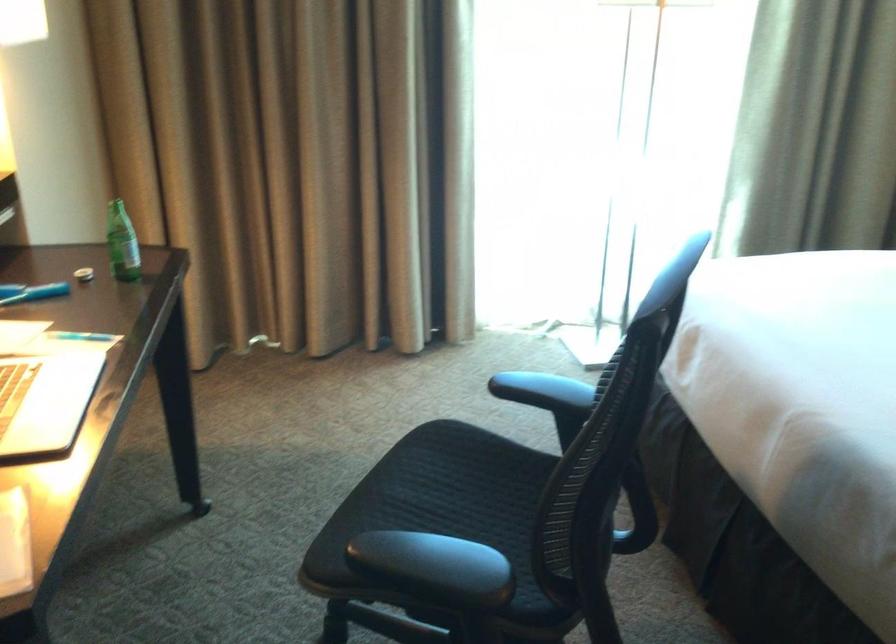
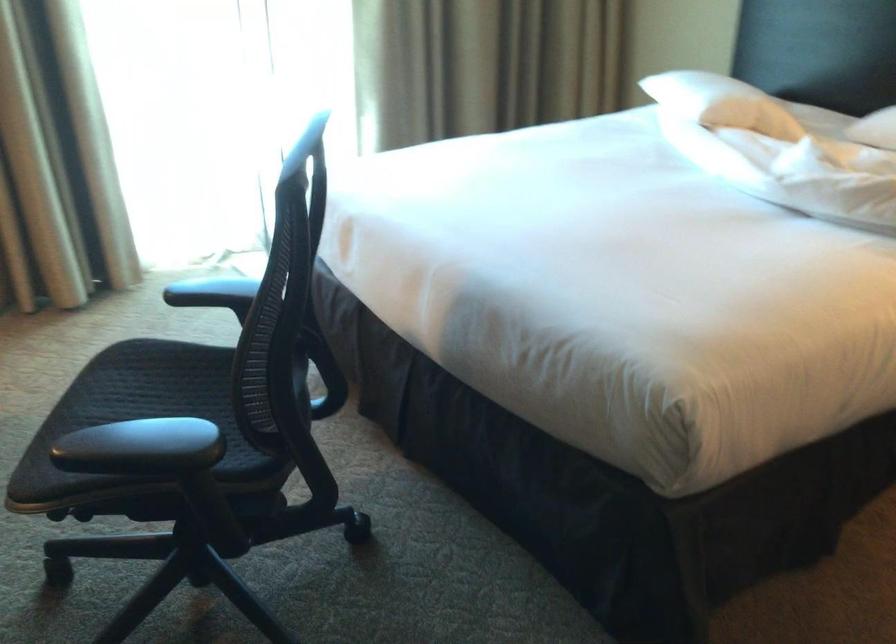
Question: The first image is from the beginning of the video and the second image is from the end. How did the camera likely rotate when shooting the video?

Choices:
 (A) Left
 (B) Right
 (C) Up
 (D) Down

Answer: (B)